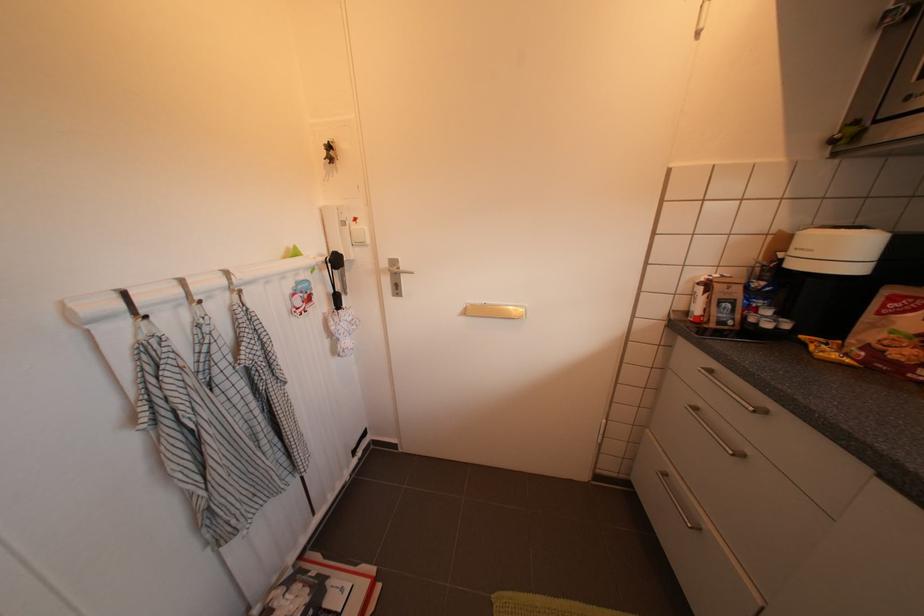
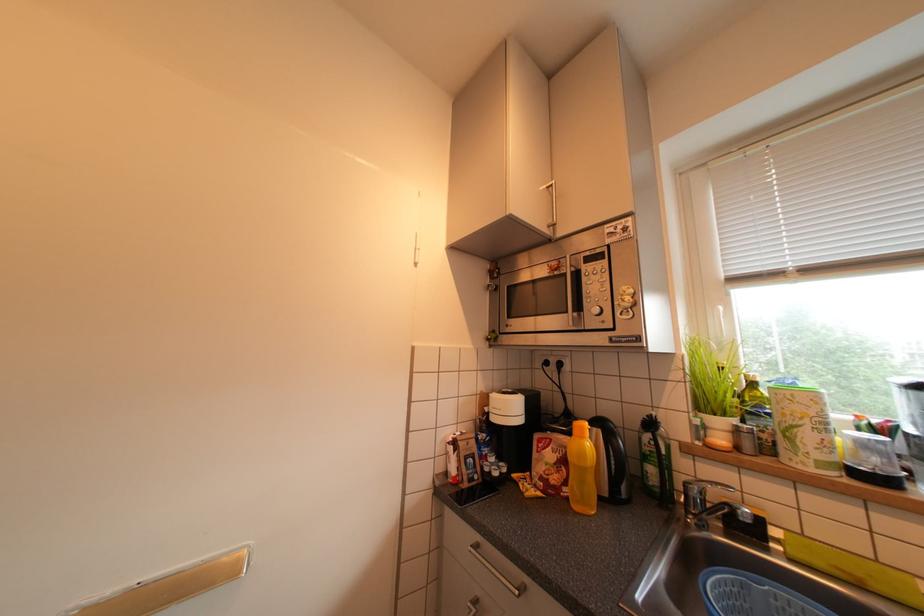
Based on the continuous images, in which direction is the camera rotating?

The rotation direction of the camera is right-up.